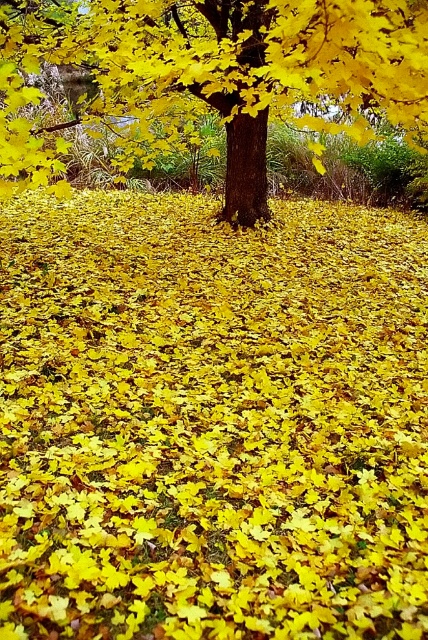
Looking at this image, you are a photographer adjusting your camera settings to capture the autumn scene. You want to ensure the yellow matte leaves at center and the shiny brown tree trunk at center are both clearly visible. Considering their sizes, which object might require more careful focus adjustment to avoid blurring?

The yellow matte leaves at center are larger in size than the shiny brown tree trunk at center, so the larger leaves might require more careful focus adjustment to ensure clarity.

You are an artist trying to paint the autumn scene. You notice the yellow matte leaves at center and the shiny brown tree trunk at center. Which object should you paint first if you want to depict the larger one in your painting?

You should paint the yellow matte leaves at center first because their width is larger than the shiny brown tree trunk at center, making them the bigger object in the scene.